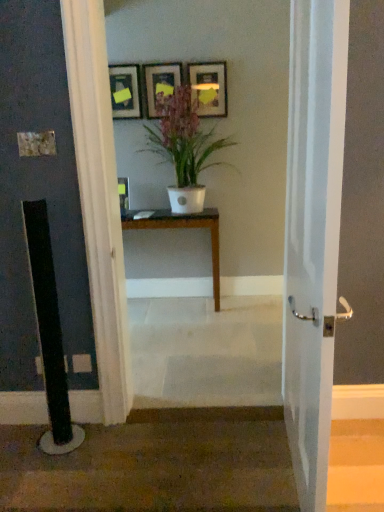
Locate an element on the screen. The width and height of the screenshot is (384, 512). free spot to the right of white glossy door at center is located at coordinates (352, 475).